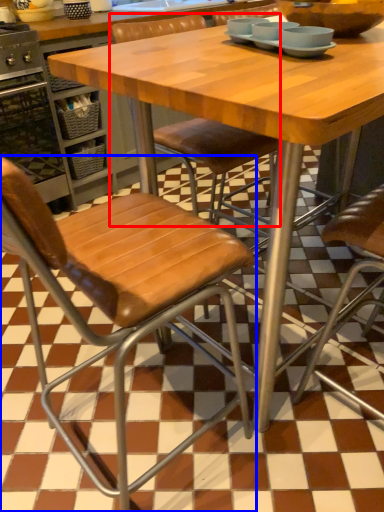
Question: Which object is closer to the camera taking this photo, chair (highlighted by a red box) or chair (highlighted by a blue box)?

Choices:
 (A) chair
 (B) chair

Answer: (B)